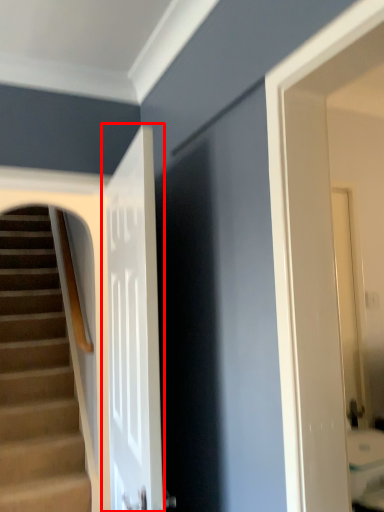
Question: From the image's perspective, where is door (annotated by the red box) located in relation to stairs in the image?

Choices:
 (A) below
 (B) above

Answer: (B)